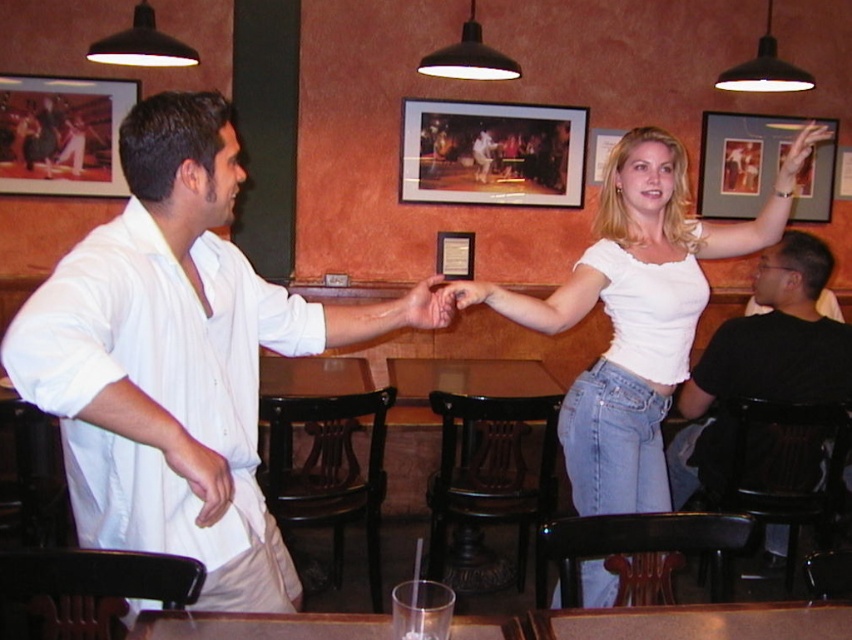
Question: Which object appears closest to the camera in this image?

Choices:
 (A) white cotton shirt at center
 (B) matte black picture frame at upper right

Answer: (A)

Question: Which object is positioned farthest from the black cotton shirt at right?

Choices:
 (A) matte black picture frame at upper right
 (B) white cotton top at upper right

Answer: (A)

Question: Which object is positioned farthest from the black cotton shirt at right?

Choices:
 (A) white cotton shirt at center
 (B) matte black picture frame at upper right

Answer: (A)

Question: Does white cotton top at upper right have a smaller size compared to black cotton shirt at right?

Choices:
 (A) no
 (B) yes

Answer: (A)

Question: Does white cotton shirt at center come in front of matte wooden picture frame at center?

Choices:
 (A) yes
 (B) no

Answer: (A)

Question: Is white cotton shirt at center to the left of white cotton top at upper right from the viewer's perspective?

Choices:
 (A) no
 (B) yes

Answer: (B)